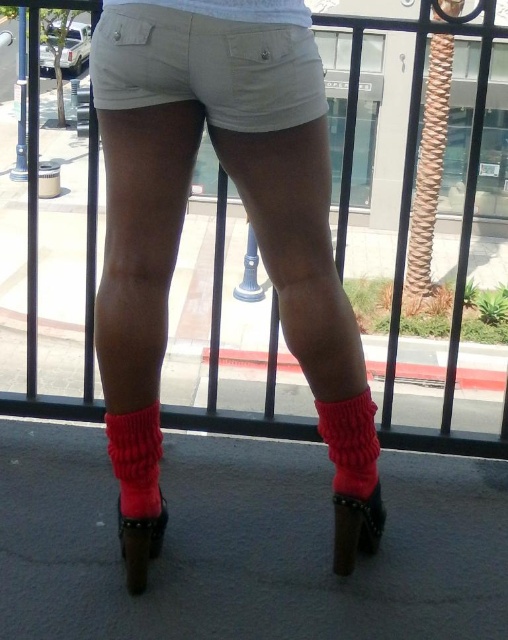
Question: Which is farther from the cotton knit leg warmer at lower center?

Choices:
 (A) light beige cotton shorts at center
 (B) crimson knitted sock at lower center
 (C) leather high-heeled shoe at lower center
 (D) leather studded boot at lower center

Answer: (A)

Question: Can you confirm if light beige cotton shorts at center is thinner than leather studded boot at lower center?

Choices:
 (A) no
 (B) yes

Answer: (A)

Question: Does cotton knit leg warmer at lower center have a larger size compared to leather studded boot at lower center?

Choices:
 (A) no
 (B) yes

Answer: (A)

Question: Does crimson knitted sock at lower center appear under leather high-heeled shoe at lower center?

Choices:
 (A) no
 (B) yes

Answer: (A)

Question: Which point appears farthest from the camera in this image?

Choices:
 (A) (344, 488)
 (B) (178, 56)

Answer: (A)

Question: Which point is farther to the camera?

Choices:
 (A) cotton knit leg warmer at lower center
 (B) light beige cotton shorts at center

Answer: (A)